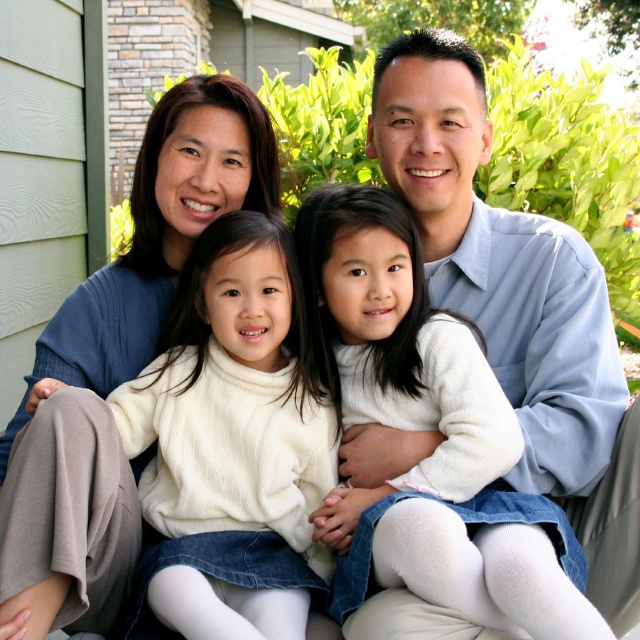
Who is higher up, white fuzzy sweater at center or matte blue sweater at upper left?

matte blue sweater at upper left

Between white fuzzy sweater at center and matte blue sweater at upper left, which one has more height?

matte blue sweater at upper left is taller.

The width and height of the screenshot is (640, 640). I want to click on white fuzzy sweater at center, so click(x=232, y=442).

Find the location of a particular element. white fuzzy sweater at center is located at coordinates (232, 442).

Is point (608, 413) positioned after point (310, 481)?

No, (608, 413) is closer to viewer.

Who is positioned more to the right, light blue shirt at upper right or white fuzzy sweater at center?

Positioned to the right is light blue shirt at upper right.

Does point (426, 44) come farther from viewer compared to point (157, 586)?

Yes, point (426, 44) is farther from viewer.

At what (x,y) coordinates should I click in order to perform the action: click on light blue shirt at upper right. Please return your answer as a coordinate pair (x, y). This screenshot has height=640, width=640. Looking at the image, I should click on (516, 304).

Does light blue shirt at upper right come behind matte blue sweater at upper left?

Yes, light blue shirt at upper right is further from the viewer.

Is point (528, 348) positioned behind point (269, 152)?

No.

Identify the location of light blue shirt at upper right. (516, 304).